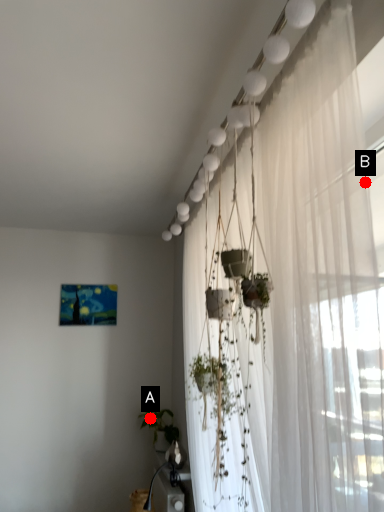
Question: Two points are circled on the image, labeled by A and B beside each circle. Which of the following is the farthest from the observer?

Choices:
 (A) A is further
 (B) B is further

Answer: (A)